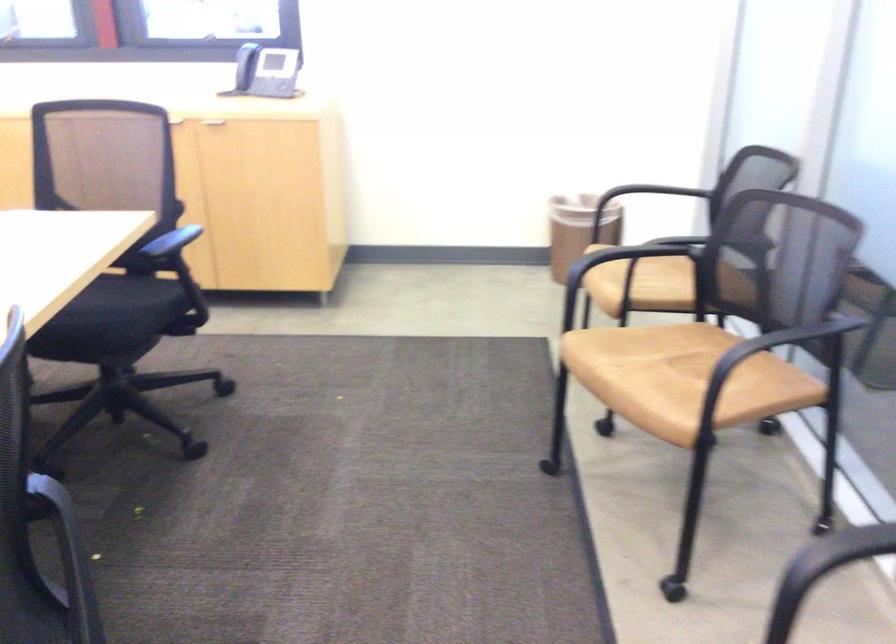
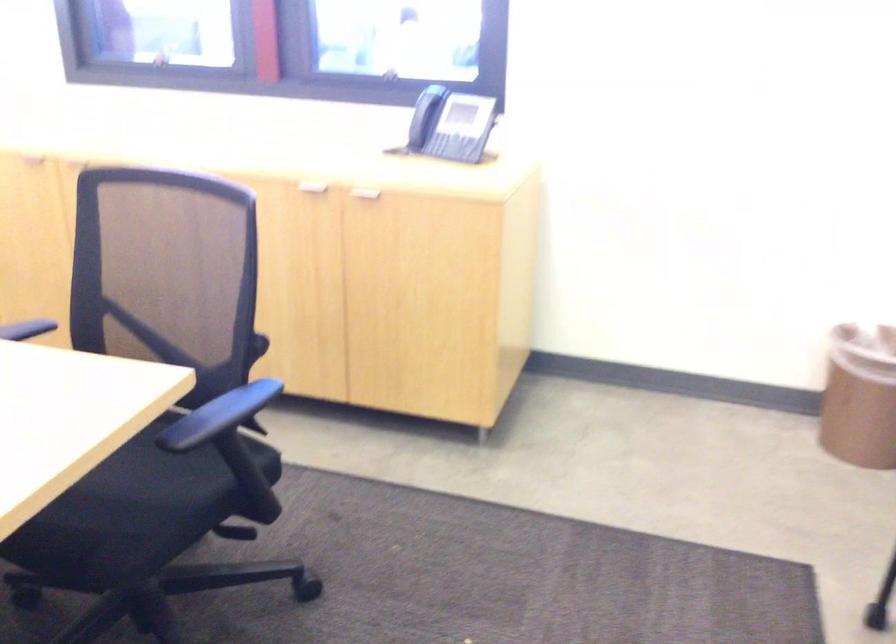
In the second image, find the point that corresponds to [245,67] in the first image.

(421, 118)